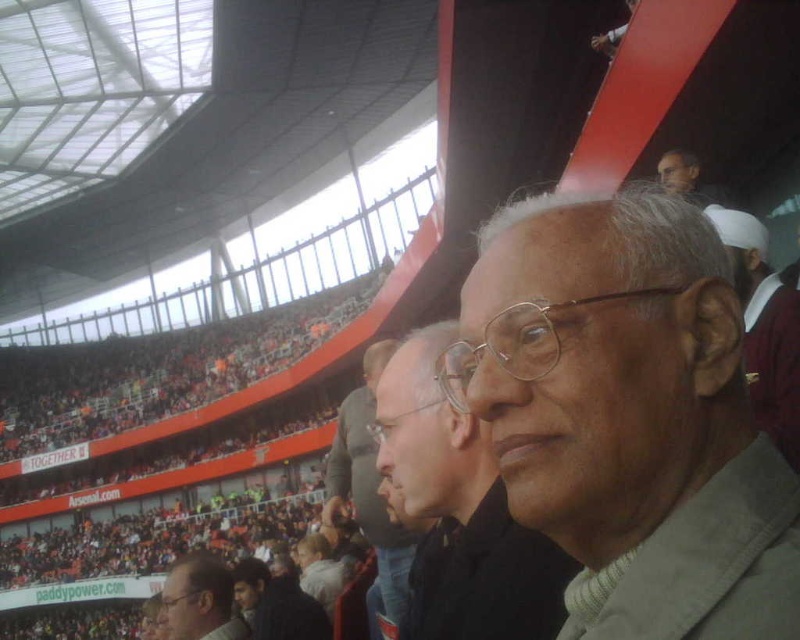
Who is positioned more to the right, brown textured jacket at center or smooth skin face at upper right?

From the viewer's perspective, smooth skin face at upper right appears more on the right side.

Find the location of a particular element. brown textured jacket at center is located at coordinates (458, 513).

What do you see at coordinates (458, 513) in the screenshot? I see `brown textured jacket at center` at bounding box center [458, 513].

Image resolution: width=800 pixels, height=640 pixels. In order to click on brown textured jacket at center in this screenshot , I will do `click(458, 513)`.

Does brown textured jacket at center lie behind light brown leather jacket at center?

Yes, brown textured jacket at center is behind light brown leather jacket at center.

Is brown textured jacket at center smaller than light brown leather jacket at center?

Actually, brown textured jacket at center might be larger than light brown leather jacket at center.

The image size is (800, 640). What do you see at coordinates (458, 513) in the screenshot?
I see `brown textured jacket at center` at bounding box center [458, 513].

You are a GUI agent. You are given a task and a screenshot of the screen. Output one action in this format:
    pyautogui.click(x=<x>, y=<y>)
    Task: Click on the brown textured jacket at center
    This screenshot has width=800, height=640.
    Given the screenshot: What is the action you would take?
    point(458,513)

Does gray woolen sweater at center have a lesser height compared to smooth skin face at upper right?

In fact, gray woolen sweater at center may be taller than smooth skin face at upper right.

Measure the distance between point [602,593] and camera.

27.38 meters

Locate an element on the screen. gray woolen sweater at center is located at coordinates (629, 417).